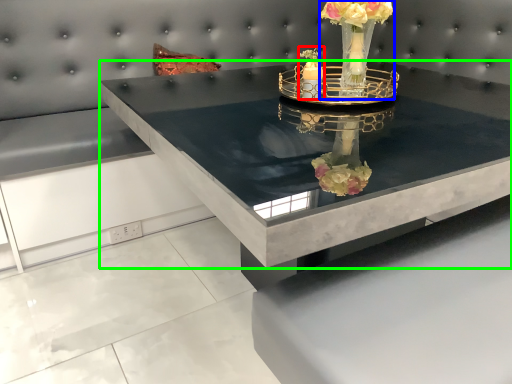
Question: Which object is positioned farthest from candle holder (highlighted by a red box)? Select from floral arrangement (highlighted by a blue box) and table (highlighted by a green box).

Choices:
 (A) floral arrangement
 (B) table

Answer: (B)